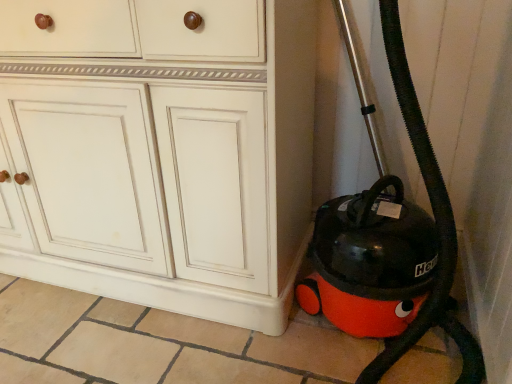
The image size is (512, 384). What do you see at coordinates (160, 152) in the screenshot?
I see `matte cream cabinet at center` at bounding box center [160, 152].

At what (x,y) coordinates should I click in order to perform the action: click on matte cream cabinet at center. Please return your answer as a coordinate pair (x, y). Looking at the image, I should click on (160, 152).

Image resolution: width=512 pixels, height=384 pixels. Identify the location of matte cream cabinet at center. (160, 152).